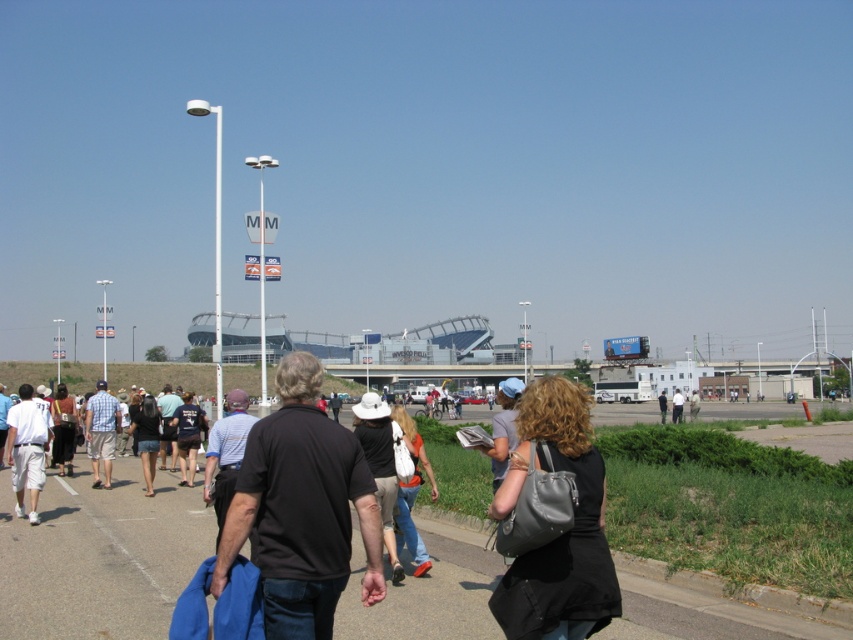
Is white cotton shorts at left shorter than denim jeans at center?

Incorrect, white cotton shorts at left's height does not fall short of denim jeans at center's.

Does white cotton shorts at left have a greater width compared to denim jeans at center?

Yes, white cotton shorts at left is wider than denim jeans at center.

I want to click on white cotton shorts at left, so click(27, 449).

Find the location of `white cotton shorts at left`. white cotton shorts at left is located at coordinates (27, 449).

Does black cotton shirt at center have a greater width compared to denim jeans at center?

Correct, the width of black cotton shirt at center exceeds that of denim jeans at center.

Does black cotton shirt at center come in front of denim jeans at center?

Yes, it is.

Who is more forward, (268, 499) or (412, 476)?

Point (268, 499) is more forward.

Image resolution: width=853 pixels, height=640 pixels. I want to click on black cotton shirt at center, so click(x=300, y=509).

Describe the element at coordinates (300, 509) in the screenshot. The image size is (853, 640). I see `black cotton shirt at center` at that location.

Is black cotton shirt at center further to the viewer compared to white cotton shorts at left?

No, it is in front of white cotton shorts at left.

Which is in front, point (370, 572) or point (9, 429)?

Point (370, 572) is more forward.

Locate an element on the screen. This screenshot has width=853, height=640. black cotton shirt at center is located at coordinates (300, 509).